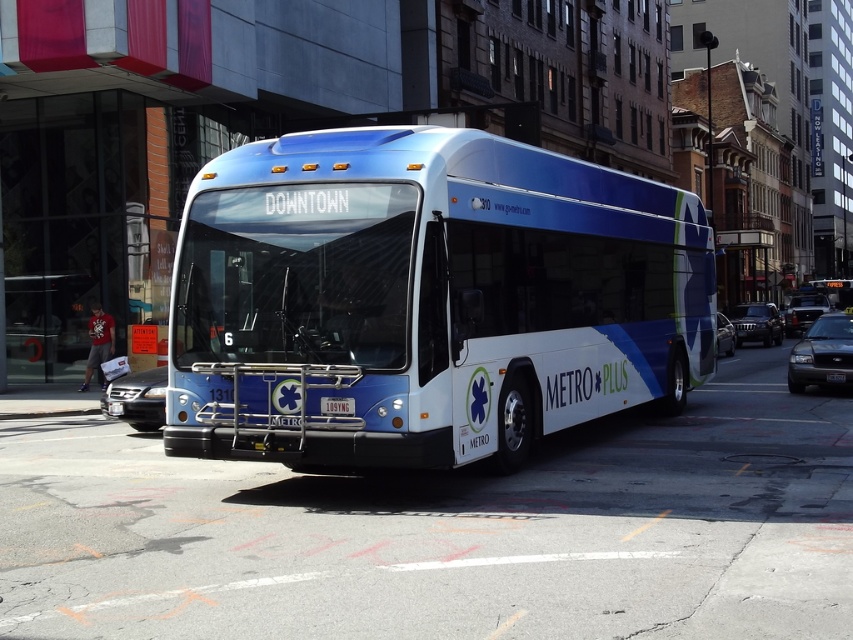
Can you confirm if black glossy sedan at right is wider than black plastic license plate at center?

In fact, black glossy sedan at right might be narrower than black plastic license plate at center.

Can you confirm if black glossy sedan at right is positioned to the right of black plastic license plate at center?

Yes, black glossy sedan at right is to the right of black plastic license plate at center.

Describe the element at coordinates (821, 353) in the screenshot. I see `black glossy sedan at right` at that location.

Locate an element on the screen. The height and width of the screenshot is (640, 853). black glossy sedan at right is located at coordinates point(821,353).

Does point (837, 285) come farther from viewer compared to point (734, 337)?

Yes, it is.

Who is shorter, blue metallic bus at center or shiny black sedan at right?

shiny black sedan at right is shorter.

This screenshot has width=853, height=640. In order to click on blue metallic bus at center in this screenshot , I will do `click(831, 291)`.

Who is more forward, (808, 369) or (339, 404)?

Point (339, 404) is more forward.

In the scene shown: Is black glossy sedan at right thinner than white plastic license plate at center?

Indeed, black glossy sedan at right has a lesser width compared to white plastic license plate at center.

Who is more distant from viewer, [834,323] or [332,412]?

Positioned behind is point [834,323].

Where is `black glossy sedan at right`? The height and width of the screenshot is (640, 853). black glossy sedan at right is located at coordinates (821, 353).